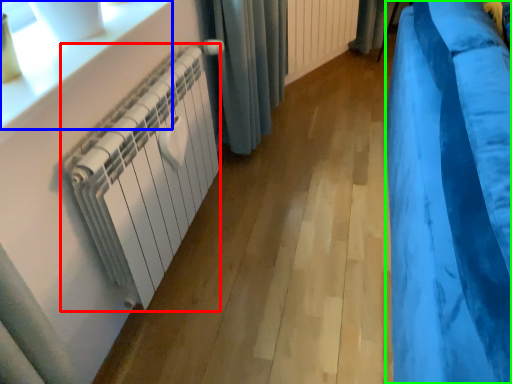
Question: Estimate the real-world distances between objects in this image. Which object is closer to radiator (highlighted by a red box), window sill (highlighted by a blue box) or curtain (highlighted by a green box)?

Choices:
 (A) window sill
 (B) curtain

Answer: (A)